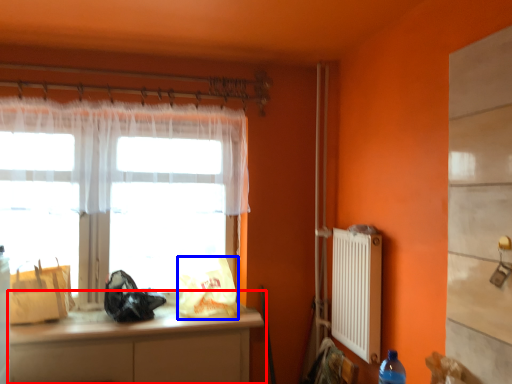
Question: Among these objects, which one is nearest to the camera, cabinetry (highlighted by a red box) or bag (highlighted by a blue box)?

Choices:
 (A) cabinetry
 (B) bag

Answer: (A)